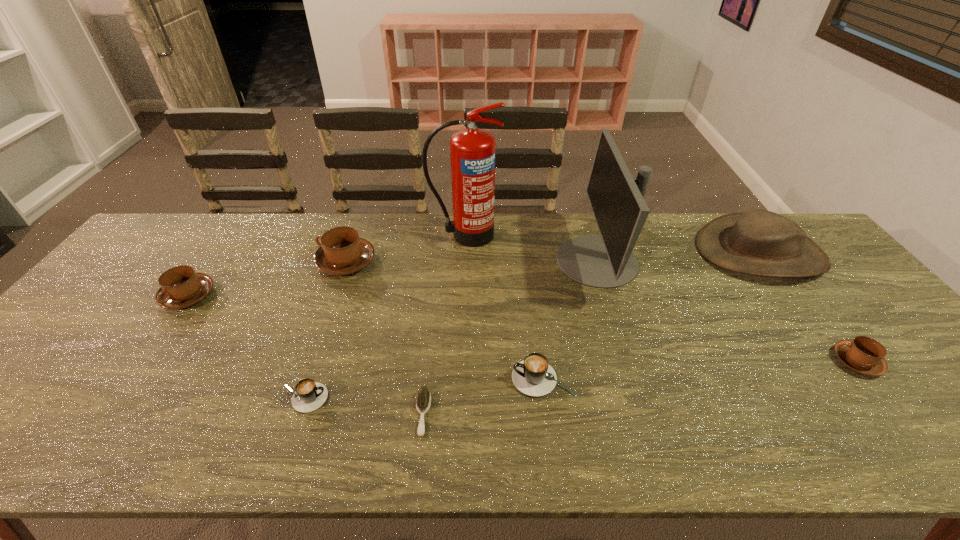
Image resolution: width=960 pixels, height=540 pixels. Identify the location of brown cappuccino that is the second closest to the left black cappuccino. (181, 287).

You are a GUI agent. You are given a task and a screenshot of the screen. Output one action in this format:
    pyautogui.click(x=<x>, y=<y>)
    Task: Click on the vacant space that satisfies the following two spatial constraints: 1. on the surface of the tallest object; 2. with the handle on the side of the left black cappuccino
    The width and height of the screenshot is (960, 540).
    Given the screenshot: What is the action you would take?
    pyautogui.click(x=458, y=398)

Locate an element on the screen. free point that satisfies the following two spatial constraints: 1. with the handle on the side of the fourth object from right to left; 2. on the front side of the scrubbing brush is located at coordinates (547, 413).

Where is `vacant area in the image that satisfies the following two spatial constraints: 1. with the handle on the side of the shortest cappuccino; 2. on the right side of the shortest object`? This screenshot has width=960, height=540. vacant area in the image that satisfies the following two spatial constraints: 1. with the handle on the side of the shortest cappuccino; 2. on the right side of the shortest object is located at coordinates (299, 413).

Identify the location of vacant point that satisfies the following two spatial constraints: 1. on the screen of the third object from right to left; 2. on the side of the fifth tallest object with the handle. (608, 295).

The height and width of the screenshot is (540, 960). Find the location of `vacant space that satisfies the following two spatial constraints: 1. with the handle on the side of the eighth tallest object; 2. on the left side of the scrubbing brush`. vacant space that satisfies the following two spatial constraints: 1. with the handle on the side of the eighth tallest object; 2. on the left side of the scrubbing brush is located at coordinates (299, 413).

The width and height of the screenshot is (960, 540). What are the coordinates of `vacant space that satisfies the following two spatial constraints: 1. with the handle on the side of the smaller black cappuccino; 2. on the right side of the shortest object` in the screenshot? It's located at (299, 413).